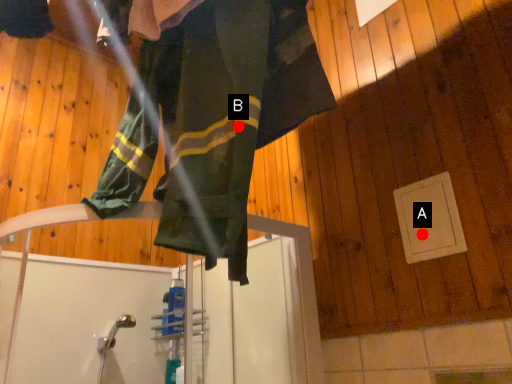
Question: Two points are circled on the image, labeled by A and B beside each circle. Among these points, which one is farthest from the camera?

Choices:
 (A) A is further
 (B) B is further

Answer: (A)